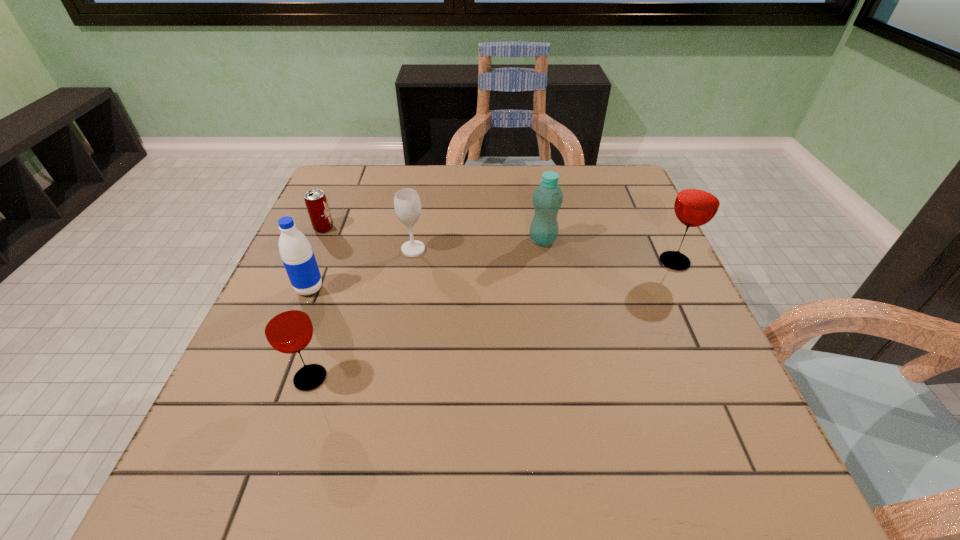
Locate an element on the screen. the fifth object from left to right is located at coordinates (547, 198).

This screenshot has width=960, height=540. I want to click on free space located on the right of the shorter glass, so click(x=494, y=378).

At what (x,y) coordinates should I click in order to perform the action: click on vacant area situated on the back of the tallest object. Please return your answer as a coordinate pair (x, y). This screenshot has height=540, width=960. Looking at the image, I should click on (636, 183).

The height and width of the screenshot is (540, 960). I want to click on free region located 0.400m on the back of the second nearest object, so click(351, 186).

Find the location of `blank area located 0.070m on the front of the wineglass`. blank area located 0.070m on the front of the wineglass is located at coordinates (408, 278).

Where is `free space located 0.400m on the front of the shortest object`? free space located 0.400m on the front of the shortest object is located at coordinates [265, 363].

Locate an element on the screen. The height and width of the screenshot is (540, 960). vacant region located at the front cap of the right water bottle is located at coordinates (409, 240).

This screenshot has width=960, height=540. In order to click on vacant space situated at the front cap of the right water bottle in this screenshot , I will do coord(393,240).

Identify the location of free space located 0.390m at the front cap of the right water bottle. This screenshot has height=540, width=960. 372,240.

Locate an element on the screen. The width and height of the screenshot is (960, 540). object that is at the near edge is located at coordinates (287, 326).